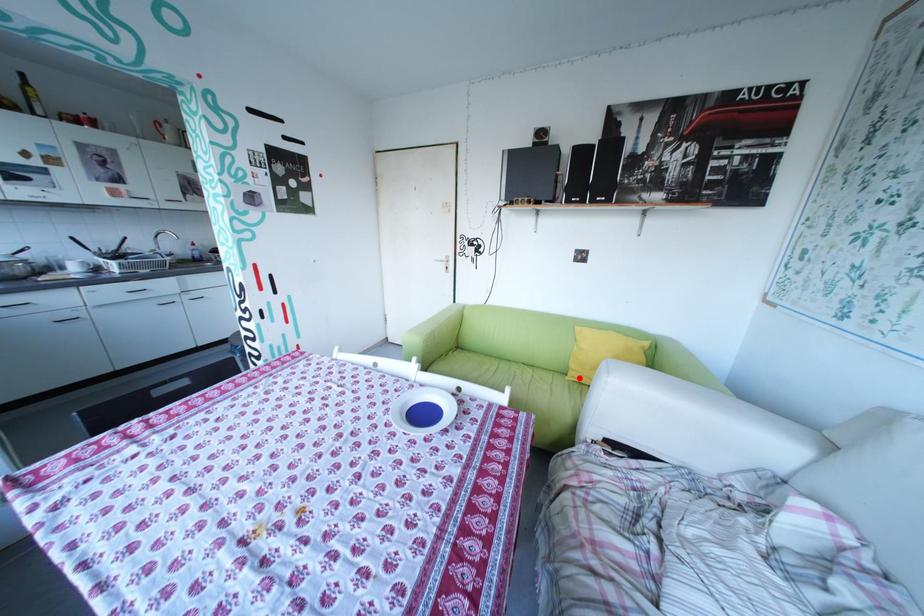
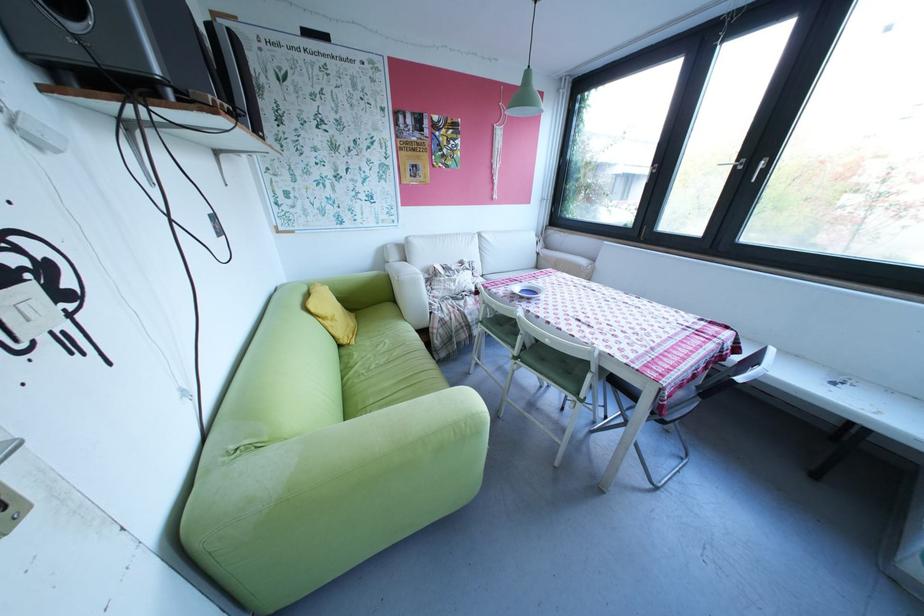
Find the pixel in the second image that matches the highlighted location in the first image.

(366, 342)